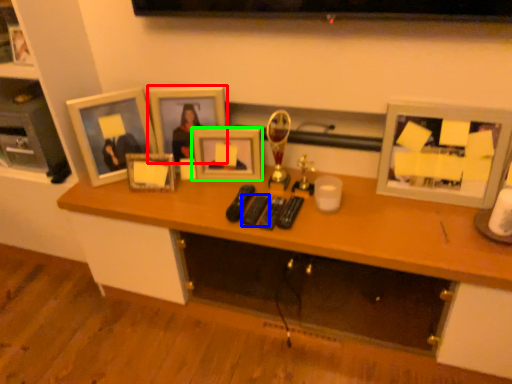
Question: Considering the real-world distances, which object is closest to picture frame (highlighted by a red box)? remote control (highlighted by a blue box) or picture frame (highlighted by a green box).

Choices:
 (A) remote control
 (B) picture frame

Answer: (B)